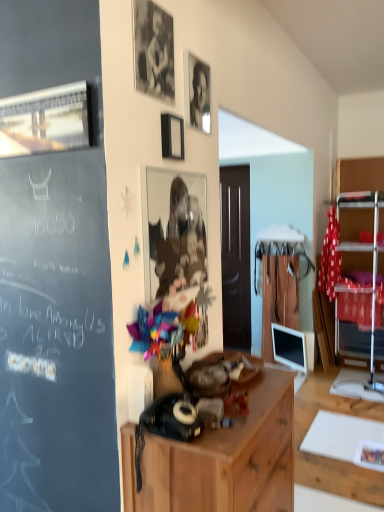
The width and height of the screenshot is (384, 512). Find the location of `wooden cabinet at center`. wooden cabinet at center is located at coordinates (221, 459).

What do you see at coordinates (153, 50) in the screenshot? This screenshot has height=512, width=384. I see `black matte photo frame at upper center, which is the 3th picture frame in right-to-left order` at bounding box center [153, 50].

What is the approximate height of metallic silver shelf at right?

The height of metallic silver shelf at right is 4.09 feet.

Where is `black glossy photo frame at upper center`? The width and height of the screenshot is (384, 512). black glossy photo frame at upper center is located at coordinates (200, 97).

How much space does metallic reflective photo frame at center, which is the fourth picture frame from top to bottom, occupy horizontally?

metallic reflective photo frame at center, which is the fourth picture frame from top to bottom, is 1.16 inches wide.

This screenshot has height=512, width=384. Describe the element at coordinates (46, 120) in the screenshot. I see `metallic silver picture frame at upper left, the first picture frame positioned from the left` at that location.

Image resolution: width=384 pixels, height=512 pixels. In order to click on black matte picture frame at upper center, which ranks as the second picture frame in right-to-left order in this screenshot , I will do `click(172, 136)`.

Is metallic silver shelf at right taller than metallic silver picture frame at upper left, which appears as the second picture frame when ordered from the bottom?

Correct, metallic silver shelf at right is much taller as metallic silver picture frame at upper left, which appears as the second picture frame when ordered from the bottom.

Based on the photo, is metallic silver shelf at right outside of metallic silver picture frame at upper left, which is counted as the fourth picture frame, starting from the right?

Yes.

Is metallic silver shelf at right bigger than metallic silver picture frame at upper left, the first picture frame positioned from the left?

Yes.

Does black glossy photo frame at upper center have a lesser height compared to black matte photo frame at upper center, acting as the 4th picture frame starting from the bottom?

Indeed, black glossy photo frame at upper center has a lesser height compared to black matte photo frame at upper center, acting as the 4th picture frame starting from the bottom.

Between point (199, 126) and point (167, 72), which one is positioned behind?

Point (199, 126)

From the image's perspective, does black glossy photo frame at upper center appear higher than black matte photo frame at upper center, the second picture frame when ordered from left to right?

No.

Is black matte photo frame at upper center, which is the 3th picture frame in right-to-left order, located within black glossy photo frame at upper center?

No, black matte photo frame at upper center, which is the 3th picture frame in right-to-left order, is located outside of black glossy photo frame at upper center.

Considering the relative sizes of wooden cabinet at center and black glossy photo frame at upper center in the image provided, is wooden cabinet at center taller than black glossy photo frame at upper center?

Yes.

Is wooden cabinet at center not within black glossy photo frame at upper center?

Indeed, wooden cabinet at center is completely outside black glossy photo frame at upper center.

Is point (227, 496) in front of point (199, 123)?

Yes.

From the image's perspective, is wooden cabinet at center under black matte picture frame at upper center, which is counted as the 2th picture frame, starting from the top?

Yes.

Locate an element on the screen. the 3rd picture frame positioned above the wooden cabinet at center (from the image's perspective) is located at coordinates (172, 136).

Does wooden cabinet at center have a lesser width compared to black matte picture frame at upper center, which is counted as the 2th picture frame, starting from the top?

In fact, wooden cabinet at center might be wider than black matte picture frame at upper center, which is counted as the 2th picture frame, starting from the top.

Is the surface of wooden cabinet at center in direct contact with black matte picture frame at upper center, which ranks as the second picture frame in right-to-left order?

wooden cabinet at center is not next to black matte picture frame at upper center, which ranks as the second picture frame in right-to-left order, and they're not touching.

Between point (181, 253) and point (198, 117), which one is positioned in front?

The point (181, 253) is more forward.

Looking at this image, is the depth of metallic reflective photo frame at center, acting as the 4th picture frame starting from the left, greater than that of black glossy photo frame at upper center?

No, it is in front of black glossy photo frame at upper center.

Between metallic reflective photo frame at center, which is the 1th picture frame from right to left, and black glossy photo frame at upper center, which one has smaller width?

metallic reflective photo frame at center, which is the 1th picture frame from right to left, is thinner.

Who is shorter, black matte picture frame at upper center, the third picture frame from the left, or metallic silver picture frame at upper left, which is counted as the fourth picture frame, starting from the right?

black matte picture frame at upper center, the third picture frame from the left.

In the scene shown: Choose the correct answer: Is black matte picture frame at upper center, which is counted as the 2th picture frame, starting from the top, inside metallic silver picture frame at upper left, the first picture frame positioned from the left, or outside it?

black matte picture frame at upper center, which is counted as the 2th picture frame, starting from the top, cannot be found inside metallic silver picture frame at upper left, the first picture frame positioned from the left.

From the image's perspective, is black matte picture frame at upper center, which is counted as the 2th picture frame, starting from the top, on metallic silver picture frame at upper left, the first picture frame positioned from the left?

Yes, from the image's perspective, black matte picture frame at upper center, which is counted as the 2th picture frame, starting from the top, is above metallic silver picture frame at upper left, the first picture frame positioned from the left.

Is metallic silver picture frame at upper left, which appears as the second picture frame when ordered from the bottom, facing away from black matte picture frame at upper center, which ranks as the second picture frame in right-to-left order?

Yes, black matte picture frame at upper center, which ranks as the second picture frame in right-to-left order, is at the back of metallic silver picture frame at upper left, which appears as the second picture frame when ordered from the bottom.

In order to click on the 1st picture frame below the black matte picture frame at upper center, the third picture frame from the left (from the image's perspective) in this screenshot , I will do `click(46, 120)`.

What's the angular difference between metallic silver picture frame at upper left, the first picture frame positioned from the left, and black matte picture frame at upper center, the third picture frame from the left,'s facing directions?

91.4 degrees.

Between metallic silver picture frame at upper left, which is counted as the fourth picture frame, starting from the right, and black matte picture frame at upper center, which is the third picture frame in bottom-to-top order, which one appears on the right side from the viewer's perspective?

black matte picture frame at upper center, which is the third picture frame in bottom-to-top order, is more to the right.

Locate an element on the screen. The height and width of the screenshot is (512, 384). shelf behind the metallic silver picture frame at upper left, which appears as the second picture frame when ordered from the bottom is located at coordinates (359, 208).

What are the coordinates of `person lying below the black matte photo frame at upper center, which is the 3th picture frame in right-to-left order (from the image's perspective)` in the screenshot? It's located at (200, 97).

When comparing their distances from black matte picture frame at upper center, the third picture frame from the left, does metallic silver picture frame at upper left, which appears as the second picture frame when ordered from the bottom, or metallic reflective photo frame at center, acting as the 4th picture frame starting from the left, seem closer?

Among the two, metallic reflective photo frame at center, acting as the 4th picture frame starting from the left, is located nearer to black matte picture frame at upper center, the third picture frame from the left.

Which object lies further to the anchor point wooden cabinet at center, metallic silver picture frame at upper left, the first picture frame positioned from the left, or black glossy photo frame at upper center?

black glossy photo frame at upper center lies further to wooden cabinet at center than the other object.

When comparing their distances from black matte photo frame at upper center, acting as the 4th picture frame starting from the bottom, does metallic silver picture frame at upper left, which is counted as the third picture frame, starting from the top, or metallic reflective photo frame at center, acting as the 4th picture frame starting from the left, seem closer?

Based on the image, metallic silver picture frame at upper left, which is counted as the third picture frame, starting from the top, appears to be nearer to black matte photo frame at upper center, acting as the 4th picture frame starting from the bottom.

Estimate the real-world distances between objects in this image. Which object is closer to metallic silver picture frame at upper left, which is counted as the third picture frame, starting from the top, metallic reflective photo frame at center, acting as the 4th picture frame starting from the left, or metallic silver shelf at right?

metallic reflective photo frame at center, acting as the 4th picture frame starting from the left, lies closer to metallic silver picture frame at upper left, which is counted as the third picture frame, starting from the top, than the other object.

Based on the photo, when comparing their distances from black matte picture frame at upper center, which is counted as the 2th picture frame, starting from the top, does metallic reflective photo frame at center, which is the fourth picture frame from top to bottom, or wooden cabinet at center seem closer?

The object closer to black matte picture frame at upper center, which is counted as the 2th picture frame, starting from the top, is metallic reflective photo frame at center, which is the fourth picture frame from top to bottom.

Estimate the real-world distances between objects in this image. Which object is further from black matte picture frame at upper center, which is the third picture frame in bottom-to-top order, black glossy photo frame at upper center or wooden cabinet at center?

Among the two, wooden cabinet at center is located further to black matte picture frame at upper center, which is the third picture frame in bottom-to-top order.

From the image, which object appears to be farther from wooden cabinet at center, metallic silver picture frame at upper left, which is counted as the third picture frame, starting from the top, or metallic silver shelf at right?

Result: Among the two, metallic silver shelf at right is located further to wooden cabinet at center.

Considering their positions, is metallic reflective photo frame at center, which is the 1th picture frame from right to left, positioned closer to black matte photo frame at upper center, which is the 3th picture frame in right-to-left order, than metallic silver shelf at right?

metallic reflective photo frame at center, which is the 1th picture frame from right to left, lies closer to black matte photo frame at upper center, which is the 3th picture frame in right-to-left order, than the other object.

The width and height of the screenshot is (384, 512). Identify the location of person between black matte photo frame at upper center, acting as the 4th picture frame starting from the bottom, and metallic reflective photo frame at center, which is the 1th picture frame from right to left, in the up-down direction. (200, 97).

Find the location of `picture frame between metallic reflective photo frame at center, the 1th picture frame from the bottom, and metallic silver shelf at right in the front-back direction`. picture frame between metallic reflective photo frame at center, the 1th picture frame from the bottom, and metallic silver shelf at right in the front-back direction is located at coordinates 172,136.

The image size is (384, 512). Identify the location of person between black matte photo frame at upper center, acting as the 4th picture frame starting from the bottom, and wooden cabinet at center, in the vertical direction. (200, 97).

Locate an element on the screen. Image resolution: width=384 pixels, height=512 pixels. picture frame between metallic silver picture frame at upper left, which is counted as the fourth picture frame, starting from the right, and black matte picture frame at upper center, which is the third picture frame in bottom-to-top order, from left to right is located at coordinates (153, 50).